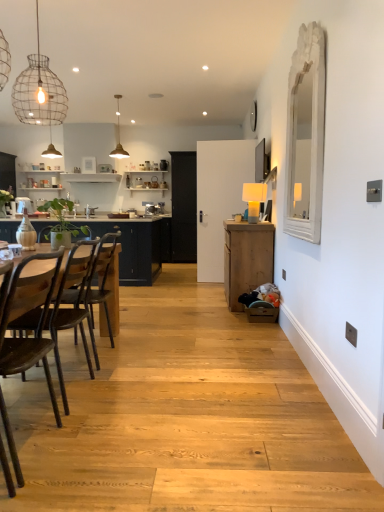
Question: From a real-world perspective, is metallic pendant light at upper center, the 1th lamp from the back, positioned above or below blue matte countertop at left?

Choices:
 (A) below
 (B) above

Answer: (B)

Question: Choose the correct answer: Is metallic pendant light at upper center, marked as the 2th lamp in a front-to-back arrangement, inside blue matte countertop at left or outside it?

Choices:
 (A) outside
 (B) inside

Answer: (A)

Question: Estimate the real-world distances between objects in this image. Which object is farther from the wooden chair at left, arranged as the first chair when viewed from the back?

Choices:
 (A) dark wood chair at left, which appears as the 1th chair when viewed from the front
 (B) wooden cabinet at right
 (C) black glass door at center
 (D) wire mesh light fixture at upper left
 (E) dark brown wood chair at left, the 2th chair from the back

Answer: (C)

Question: Which object is positioned farthest from the blue matte countertop at left?

Choices:
 (A) wooden cabinet at right
 (B) dark wood chair at left, which appears as the 1th chair when viewed from the front
 (C) black glass door at center
 (D) wire mesh light fixture at upper left
 (E) matte yellow lampshade at center-right, positioned as the first lamp in right-to-left order

Answer: (B)